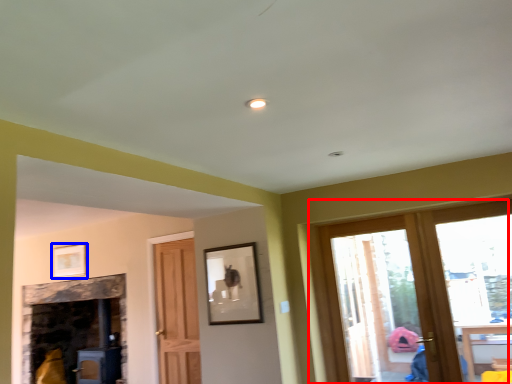
Question: Which point is further to the camera, window (highlighted by a red box) or picture frame (highlighted by a blue box)?

Choices:
 (A) window
 (B) picture frame

Answer: (B)